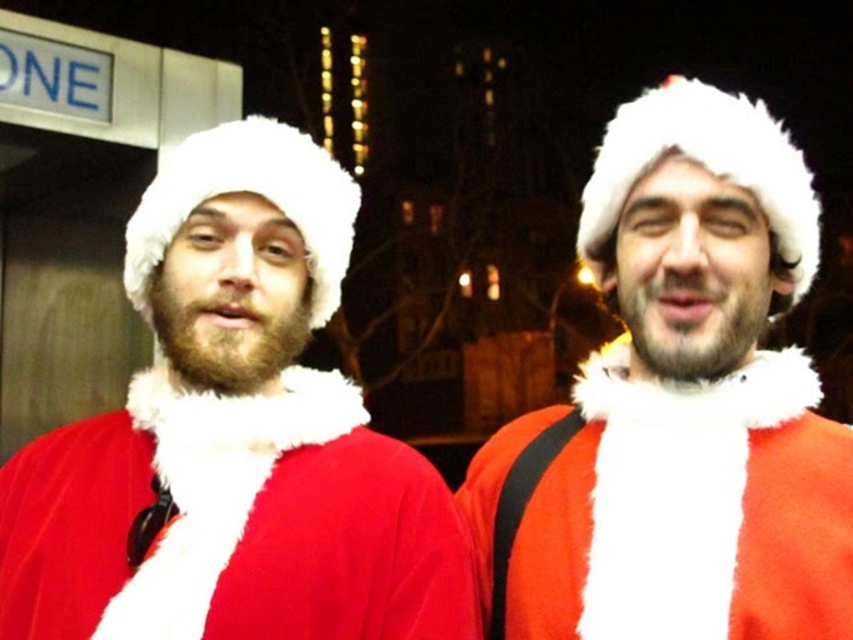
Question: Which point is farther from the camera taking this photo?

Choices:
 (A) (352, 592)
 (B) (631, 445)

Answer: (B)

Question: Is velvet red santa suit at center thinner than matte red santa suit at center?

Choices:
 (A) no
 (B) yes

Answer: (A)

Question: Which point is closer to the camera?

Choices:
 (A) (314, 496)
 (B) (732, 240)

Answer: (B)

Question: Is the position of velvet red santa suit at center less distant than that of matte red santa suit at center?

Choices:
 (A) no
 (B) yes

Answer: (A)

Question: Is velvet red santa suit at center bigger than matte red santa suit at center?

Choices:
 (A) yes
 (B) no

Answer: (B)